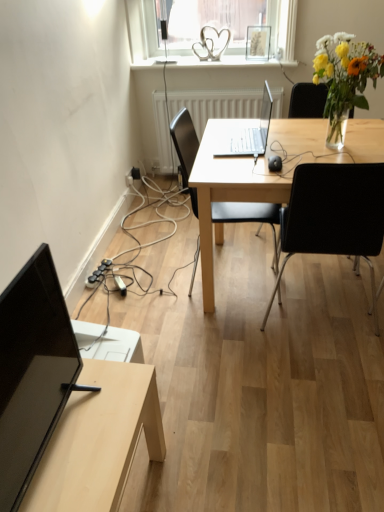
You are a GUI agent. You are given a task and a screenshot of the screen. Output one action in this format:
    pyautogui.click(x=<x>, y=<y>)
    Task: Click on the vacant space situated above white textured radiator at center (from a real-world perspective)
    
    Given the screenshot: What is the action you would take?
    pyautogui.click(x=231, y=86)